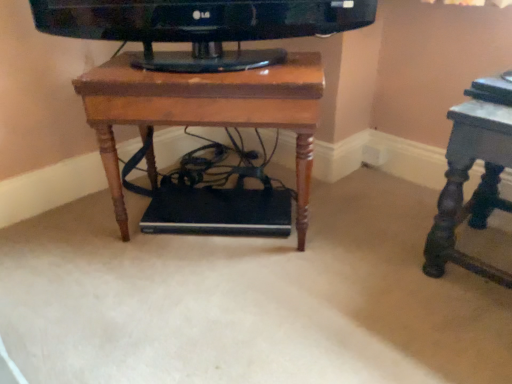
The height and width of the screenshot is (384, 512). I want to click on vacant space underneath dark gray polished wood table at right, which is counted as the second table, starting from the left (from a real-world perspective), so click(489, 258).